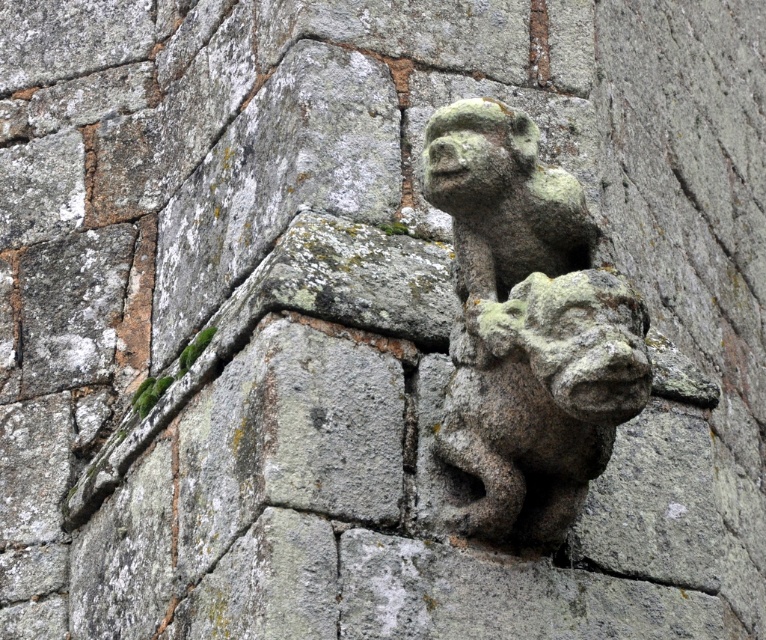
Question: Is green mossy stone gargoyle at center below green mossy stone gargoyle at upper center?

Choices:
 (A) yes
 (B) no

Answer: (A)

Question: Which of the following is the closest to the observer?

Choices:
 (A) (501, 451)
 (B) (519, 515)

Answer: (A)

Question: Does green mossy stone gargoyle at center appear under green mossy stone gargoyle at upper center?

Choices:
 (A) yes
 (B) no

Answer: (A)

Question: Is green mossy stone gargoyle at center to the left of green mossy stone gargoyle at upper center from the viewer's perspective?

Choices:
 (A) yes
 (B) no

Answer: (A)